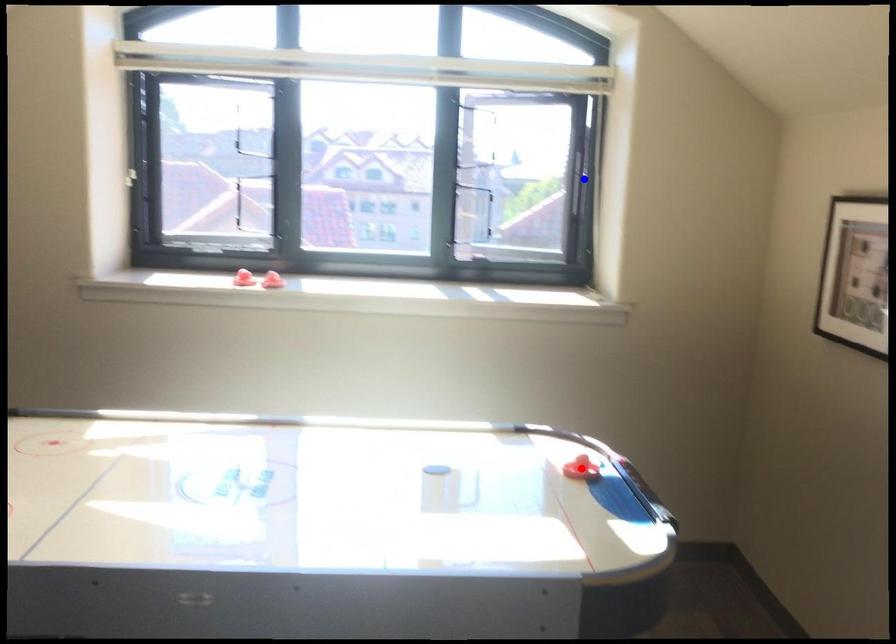
Question: Two points are marked on the image. Which point is closer to the camera?

Choices:
 (A) Blue point is closer.
 (B) Red point is closer.

Answer: (B)